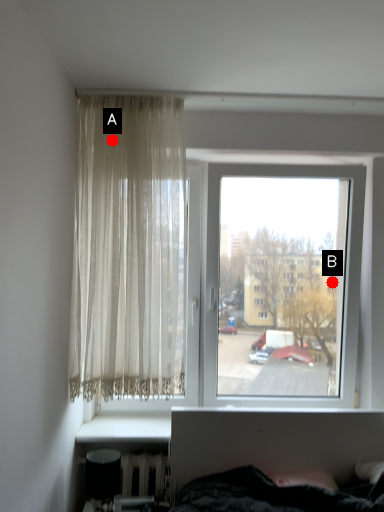
Question: Two points are circled on the image, labeled by A and B beside each circle. Which point is further to the camera?

Choices:
 (A) A is further
 (B) B is further

Answer: (B)